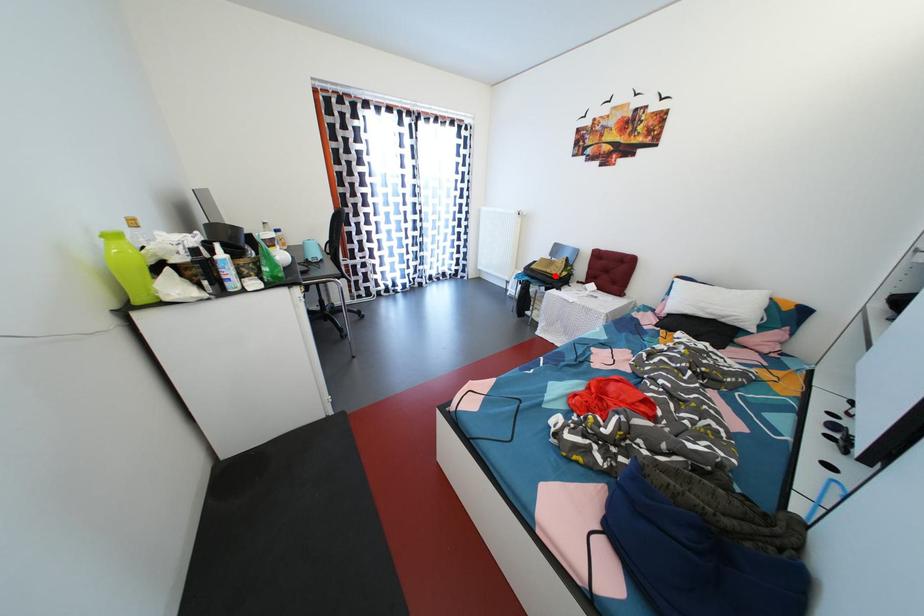
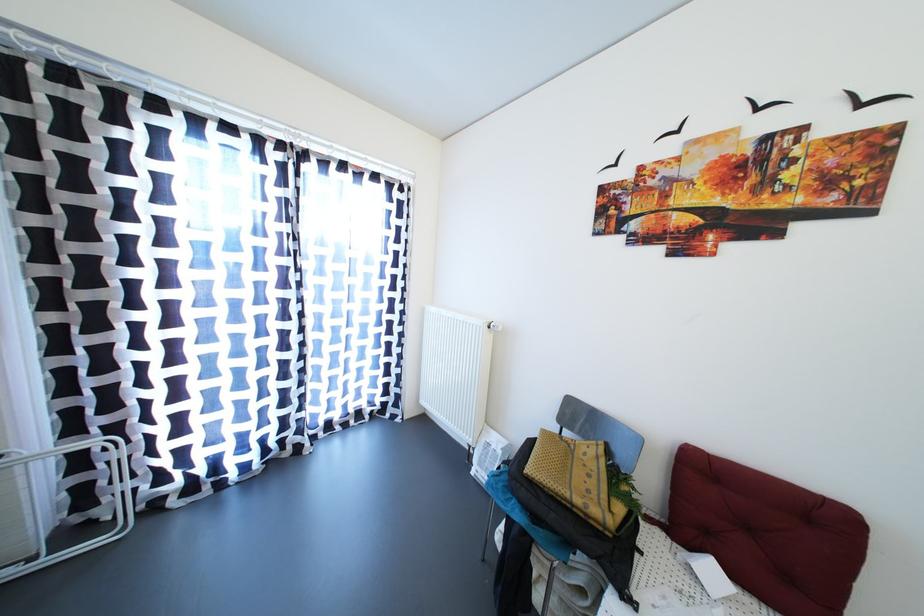
Where in the second image is the point corresponding to the highlighted location from the first image?

(584, 506)